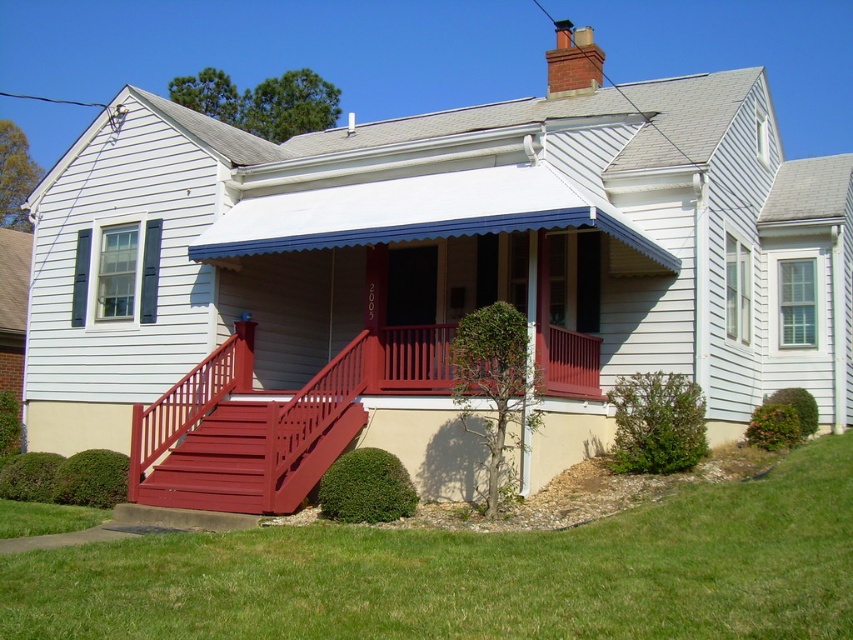
You are standing in front of the house and want to walk towards the green grass at lower center. Will you have to step over the smooth wood stairs at center to reach it?

The green grass at lower center is closer to the viewer than the smooth wood stairs at center, so you can walk directly to the green grass at lower center without needing to step over the smooth wood stairs at center.

You are a gardener who wants to mow the green grass at lower center. However, you need to avoid the smooth wood stairs at center. Based on the scene description, which object is lower to the ground and therefore safe to mow?

The green grass at lower center is shorter than the smooth wood stairs at center, so it is safe to mow the green grass at lower center without hitting the smooth wood stairs at center.

You are standing on the green grass at lower center and want to walk to the smooth red wooden porch at center. Which direction should you move to reach it?

Since the green grass at lower center is positioned on the right side of smooth red wooden porch at center, you should move to the left to reach the smooth red wooden porch at center.